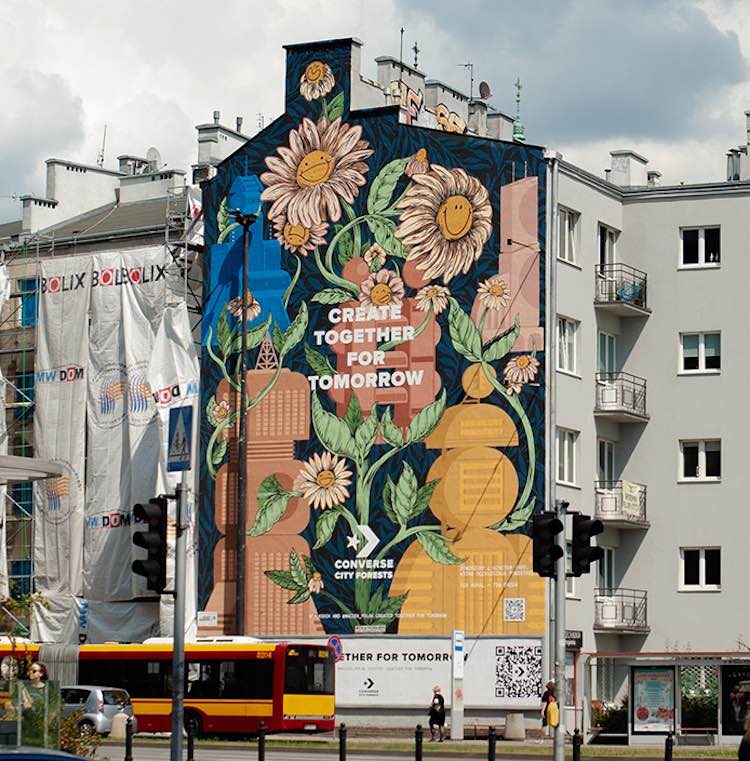
This screenshot has height=761, width=750. In order to click on building doors in this screenshot , I will do `click(610, 240)`, `click(604, 352)`, `click(604, 467)`, `click(604, 558)`.